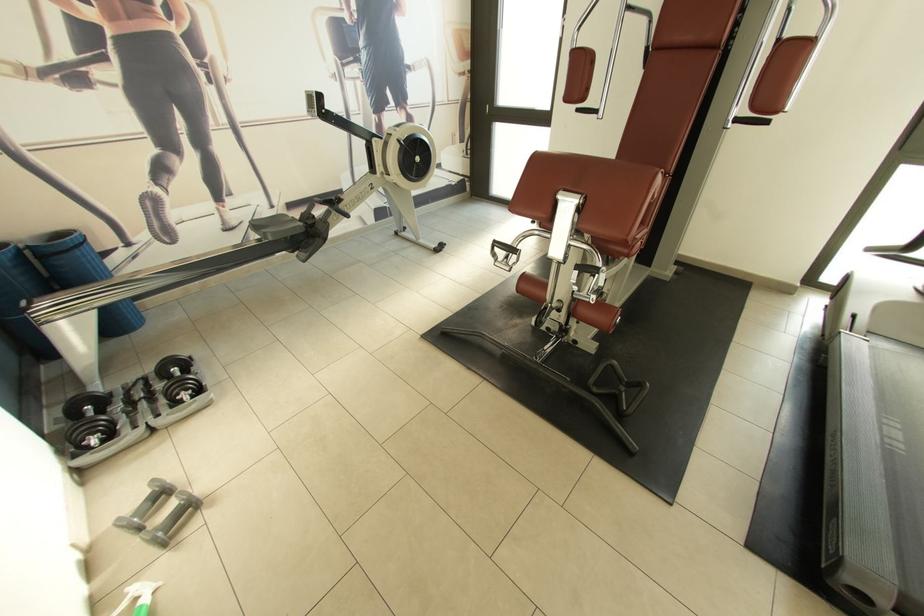
Where would you pull the black door handle? Please return your answer as a coordinate pair (x, y).

(497, 114)